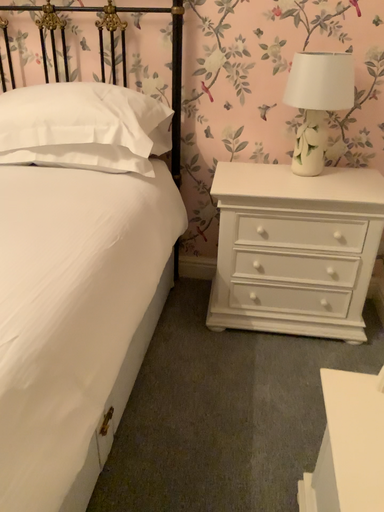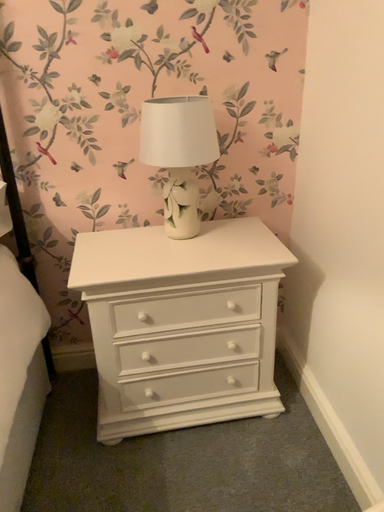
Question: How did the camera likely rotate when shooting the video?

Choices:
 (A) rotated right
 (B) rotated left

Answer: (A)